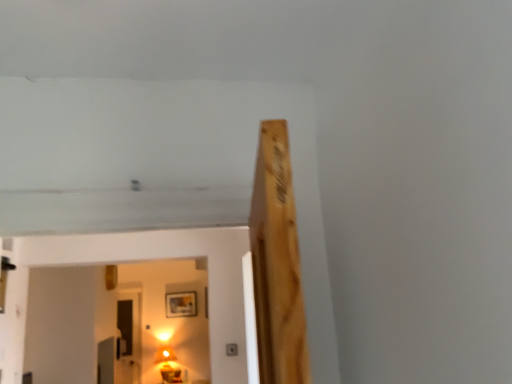
Question: From the image's perspective, is matte gold lamp at lower center over wooden picture frame at upper center?

Choices:
 (A) no
 (B) yes

Answer: (A)

Question: Can you confirm if matte gold lamp at lower center is thinner than wooden picture frame at upper center?

Choices:
 (A) yes
 (B) no

Answer: (B)

Question: Is matte gold lamp at lower center behind wooden picture frame at upper center?

Choices:
 (A) no
 (B) yes

Answer: (A)

Question: Is matte gold lamp at lower center shorter than wooden picture frame at upper center?

Choices:
 (A) no
 (B) yes

Answer: (A)

Question: Can you confirm if matte gold lamp at lower center is positioned to the left of wooden picture frame at upper center?

Choices:
 (A) yes
 (B) no

Answer: (A)

Question: Does point (128, 369) appear closer or farther from the camera than point (196, 299)?

Choices:
 (A) closer
 (B) farther

Answer: (A)

Question: Considering the positions of transparent glass door at lower left and wooden picture frame at upper center in the image, is transparent glass door at lower left wider or thinner than wooden picture frame at upper center?

Choices:
 (A) thin
 (B) wide

Answer: (B)

Question: Is transparent glass door at lower left spatially inside wooden picture frame at upper center, or outside of it?

Choices:
 (A) inside
 (B) outside

Answer: (B)

Question: Considering the positions of transparent glass door at lower left and wooden picture frame at upper center in the image, is transparent glass door at lower left bigger or smaller than wooden picture frame at upper center?

Choices:
 (A) small
 (B) big

Answer: (B)

Question: In the image, is wooden picture frame at upper center on the left side or the right side of matte gold lamp at lower center?

Choices:
 (A) right
 (B) left

Answer: (A)

Question: Is wooden picture frame at upper center bigger or smaller than matte gold lamp at lower center?

Choices:
 (A) small
 (B) big

Answer: (A)

Question: Is wooden picture frame at upper center inside the boundaries of matte gold lamp at lower center, or outside?

Choices:
 (A) inside
 (B) outside

Answer: (B)

Question: Is point pyautogui.click(x=187, y=301) closer or farther from the camera than point pyautogui.click(x=179, y=382)?

Choices:
 (A) closer
 (B) farther

Answer: (B)

Question: From the image's perspective, relative to transparent glass door at lower left, is wooden picture frame at upper center above or below?

Choices:
 (A) above
 (B) below

Answer: (A)

Question: Looking at their shapes, would you say wooden picture frame at upper center is wider or thinner than transparent glass door at lower left?

Choices:
 (A) thin
 (B) wide

Answer: (A)